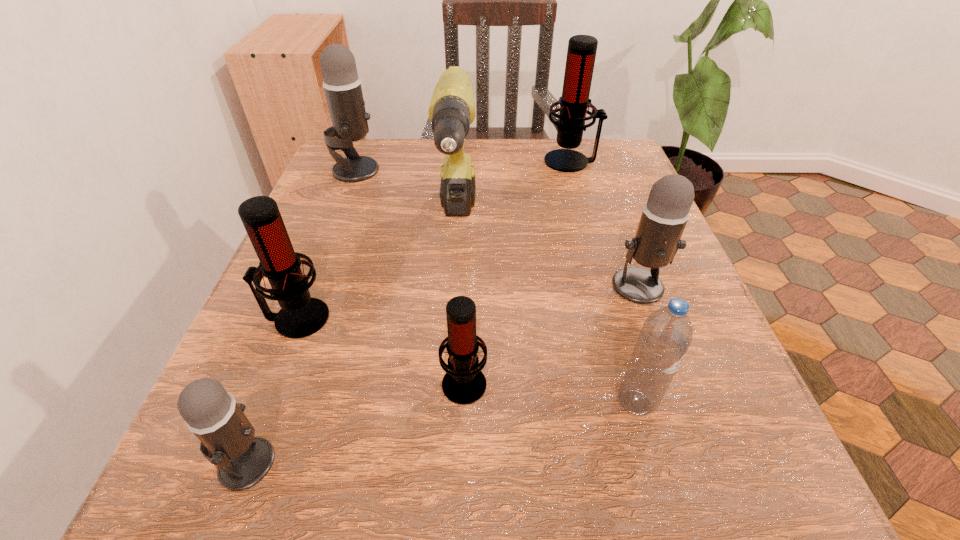
At what (x,y) coordinates should I click in order to perform the action: click on object that is the seventh closest to the second farthest gray microphone. Please return your answer as a coordinate pair (x, y). Image resolution: width=960 pixels, height=540 pixels. Looking at the image, I should click on (342, 85).

Locate which object ranks in proximity to the biggest gray microphone. Please provide its 2D coordinates. Your answer should be formatted as a tuple, i.e. [(x, y)], where the tuple contains the x and y coordinates of a point satisfying the conditions above.

[(452, 109)]

Select which microphone appears as the fifth closest to the rightmost gray microphone. Please provide its 2D coordinates. Your answer should be formatted as a tuple, i.e. [(x, y)], where the tuple contains the x and y coordinates of a point satisfying the conditions above.

[(342, 85)]

Choose which microphone is the fifth nearest neighbor to the second red microphone from left to right. Please provide its 2D coordinates. Your answer should be formatted as a tuple, i.e. [(x, y)], where the tuple contains the x and y coordinates of a point satisfying the conditions above.

[(581, 53)]

What are the coordinates of `red microphone that stands as the closest to the farthest gray microphone` in the screenshot? It's located at (300, 316).

Identify the location of red microphone that is the closest to the nearest red microphone. (300, 316).

The width and height of the screenshot is (960, 540). I want to click on the second closest gray microphone relative to the biggest red microphone, so click(342, 85).

Locate an element on the screen. This screenshot has height=540, width=960. the closest gray microphone to the farthest gray microphone is located at coordinates (658, 237).

Locate an element on the screen. free space that satisfies the following two spatial constraints: 1. on the handle side of the drill; 2. on the right side of the rightmost gray microphone is located at coordinates (453, 286).

You are a GUI agent. You are given a task and a screenshot of the screen. Output one action in this format:
    pyautogui.click(x=<x>, y=<y>)
    Task: Click on the blank area in the image that satisfies the following two spatial constraints: 1. on the front side of the second farthest gray microphone; 2. on the left side of the farthest red microphone
    
    Given the screenshot: What is the action you would take?
    pyautogui.click(x=607, y=286)